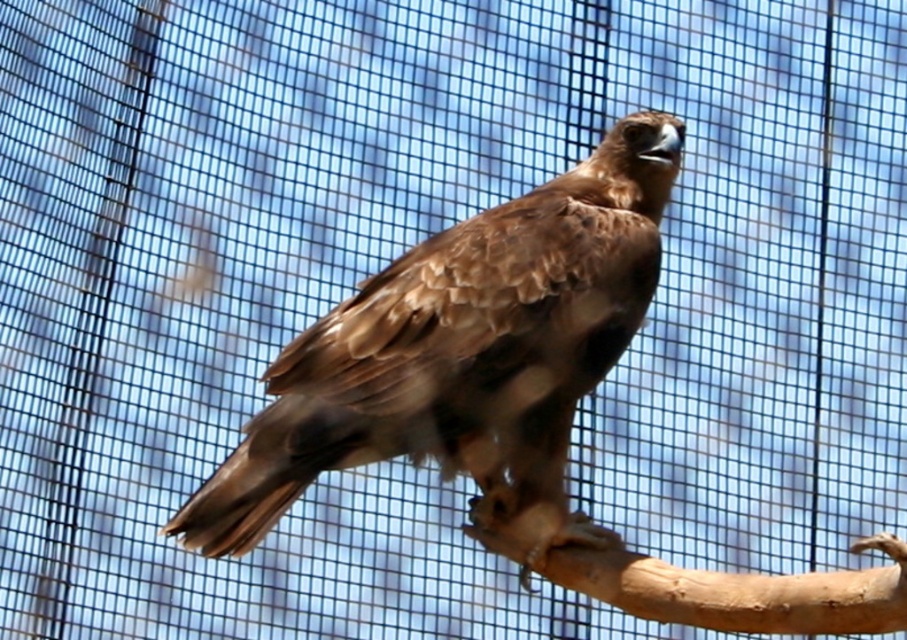
You are a photographer aiming to capture the brown feathered eagle at center in your shot. Based on its position, where should you focus your camera to ensure the eagle is centered in the frame?

The brown feathered eagle at center is located at point coordinates approximately 0.555 on the x axis and 0.514 on the y axis, so you should focus your camera at those coordinates to center the eagle in the frame.

Looking at this image, you are a photographer adjusting your camera settings to focus on two points in the image. The first point is labeled as point (511, 349) and the second is point (759, 628). Which point is closer to your camera lens?

Point (511, 349) is further to the viewer than point (759, 628), so the closer point to the camera lens is point (759, 628).

You are a photographer trying to capture a closeup of the brown feathered eagle at center and the smooth brown wood at lower center. Which object is positioned to the left side in the image?

The brown feathered eagle at center is to the left of smooth brown wood at lower center.